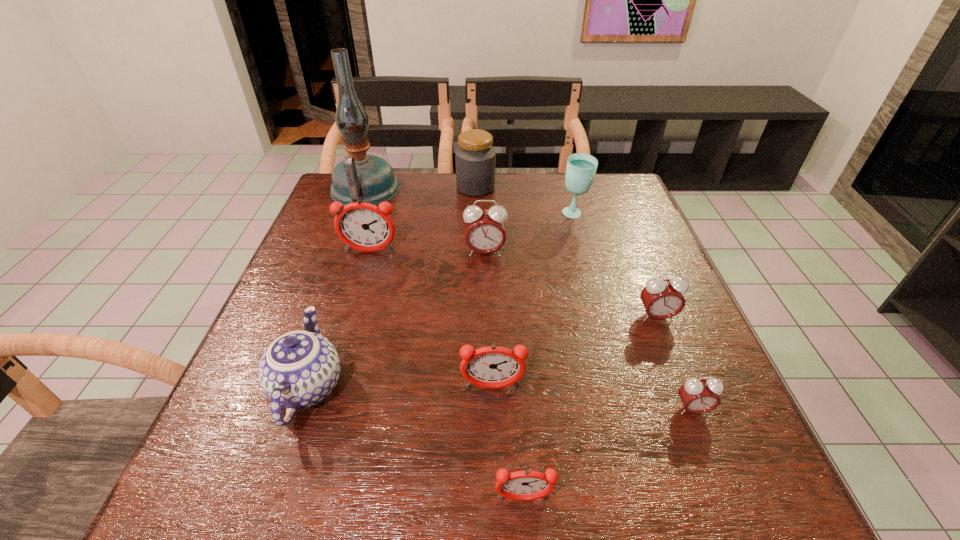
Identify which object is the fourth closest to the blue chinaware. Please provide its 2D coordinates. Your answer should be formatted as a tuple, i.e. [(x, y)], where the tuple contains the x and y coordinates of a point satisfying the conditions above.

[(485, 233)]

Identify which object is located as the seventh nearest to the nearest alarm clock. Please provide its 2D coordinates. Your answer should be formatted as a tuple, i.e. [(x, y)], where the tuple contains the x and y coordinates of a point satisfying the conditions above.

[(581, 168)]

Find the location of a particular element. This screenshot has width=960, height=540. alarm clock that can be found as the second closest to the oil lamp is located at coordinates (485, 233).

I want to click on alarm clock identified as the second closest to the jar, so click(363, 226).

Point out which pink alarm clock is positioned as the third nearest to the second smallest reddish-pink alarm clock. Please provide its 2D coordinates. Your answer should be formatted as a tuple, i.e. [(x, y)], where the tuple contains the x and y coordinates of a point satisfying the conditions above.

[(485, 233)]

Locate an element on the screen. pink alarm clock identified as the second closest to the second biggest reddish-pink alarm clock is located at coordinates (662, 298).

At what (x,y) coordinates should I click in order to perform the action: click on reddish-pink alarm clock that can be found as the second closest to the third nearest alarm clock. Please return your answer as a coordinate pair (x, y). The height and width of the screenshot is (540, 960). Looking at the image, I should click on (363, 226).

Point out which reddish-pink alarm clock is positioned as the nearest to the nearest object. Please provide its 2D coordinates. Your answer should be formatted as a tuple, i.e. [(x, y)], where the tuple contains the x and y coordinates of a point satisfying the conditions above.

[(493, 367)]

The height and width of the screenshot is (540, 960). What are the coordinates of `free space that satisfies the following two spatial constraints: 1. on the surface of the eighth object from left to right near the warning symbol; 2. on the left side of the gray jar` in the screenshot? It's located at (475, 214).